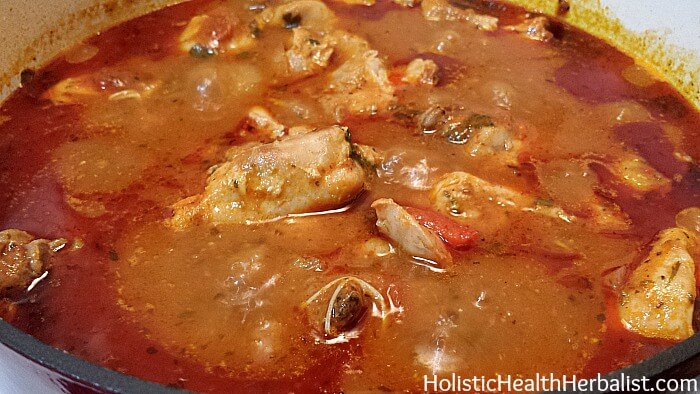
What are the coordinates of `white baking dish sides` in the screenshot? It's located at (659, 17), (629, 6).